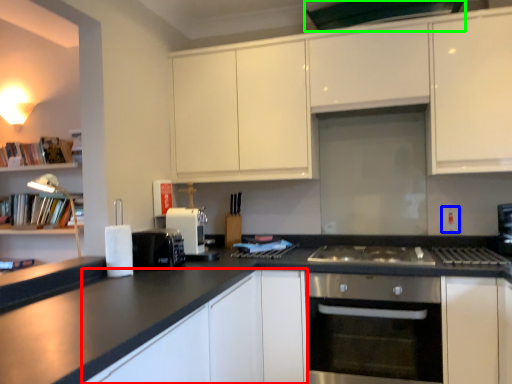
Question: Estimate the real-world distances between objects in this image. Which object is closer to cabinetry (highlighted by a red box), electric outlet (highlighted by a blue box) or exhaust hood (highlighted by a green box)?

Choices:
 (A) electric outlet
 (B) exhaust hood

Answer: (A)